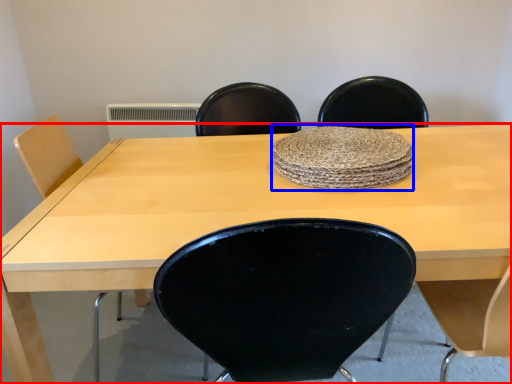
Question: Among these objects, which one is farthest to the camera, table (highlighted by a red box) or mat (highlighted by a blue box)?

Choices:
 (A) table
 (B) mat

Answer: (B)